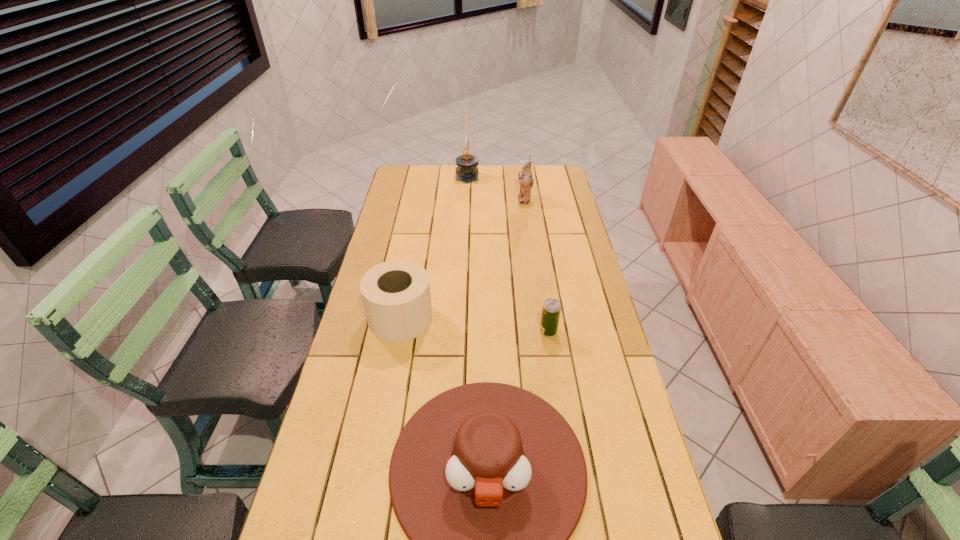
This screenshot has width=960, height=540. Find the location of `the tallest object`. the tallest object is located at coordinates (467, 163).

In order to click on oil lamp in this screenshot , I will do `click(467, 163)`.

In order to click on the fourth nearest object in this screenshot , I will do `click(525, 179)`.

Identify the location of figurine. The width and height of the screenshot is (960, 540). (525, 179).

Find the location of a particular element. The height and width of the screenshot is (540, 960). the third shortest object is located at coordinates (396, 295).

What are the coordinates of `beer can` in the screenshot? It's located at (551, 310).

Locate an element on the screen. This screenshot has width=960, height=540. free spot located 0.130m on the front of the farthest object is located at coordinates (467, 198).

I want to click on vacant region located on the front-facing side of the figurine, so click(454, 199).

Where is `vacant space located on the front-facing side of the figurine`? The width and height of the screenshot is (960, 540). vacant space located on the front-facing side of the figurine is located at coordinates (449, 199).

In order to click on vacant space located 0.180m on the front-facing side of the figurine in this screenshot , I will do pos(476,199).